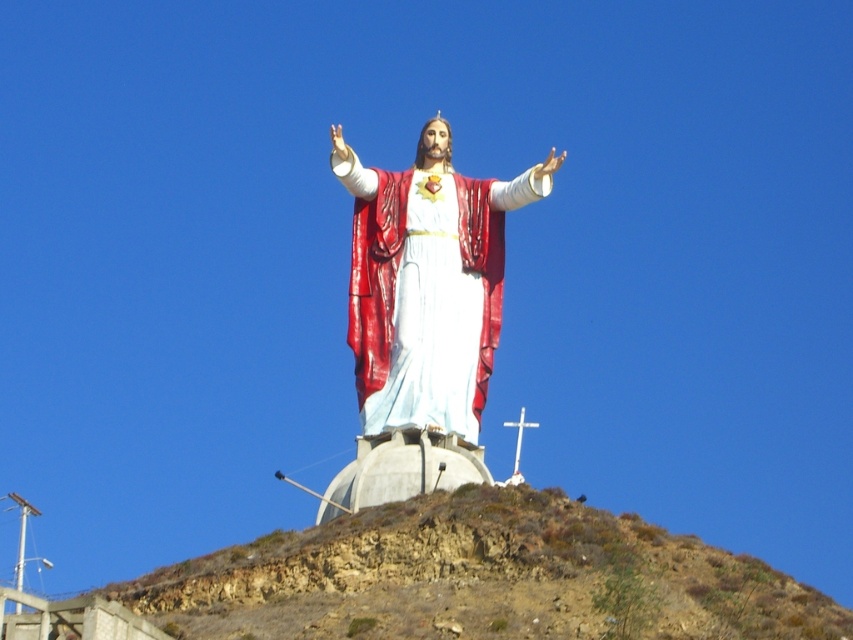
Can you confirm if brown rocky hillside at center is taller than shiny red fabric at center?

Incorrect, brown rocky hillside at center's height is not larger of shiny red fabric at center's.

Which is in front, point (723, 588) or point (358, 173)?

Point (723, 588)

Which is behind, point (263, 627) or point (412, 372)?

Point (412, 372)

Identify the location of brown rocky hillside at center. The height and width of the screenshot is (640, 853). (479, 577).